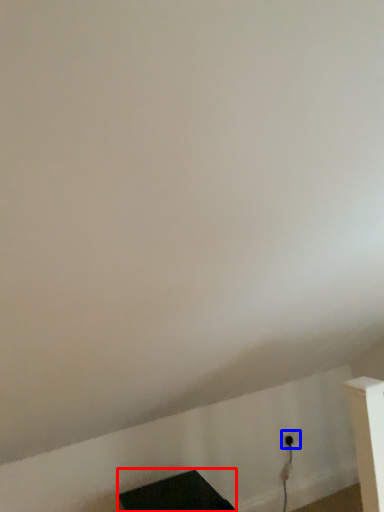
Question: Which point is closer to the camera, furniture (highlighted by a red box) or electric outlet (highlighted by a blue box)?

Choices:
 (A) furniture
 (B) electric outlet

Answer: (A)